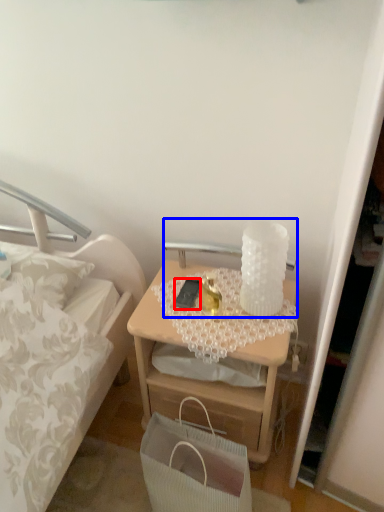
Question: Which object appears farthest to the camera in this image, mobile phone (highlighted by a red box) or table lamp (highlighted by a blue box)?

Choices:
 (A) mobile phone
 (B) table lamp

Answer: (B)